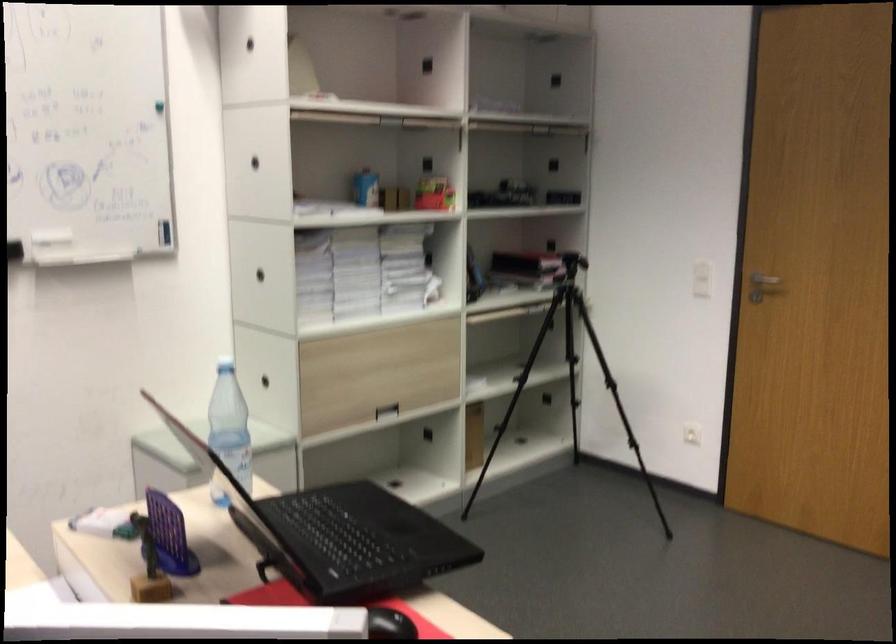
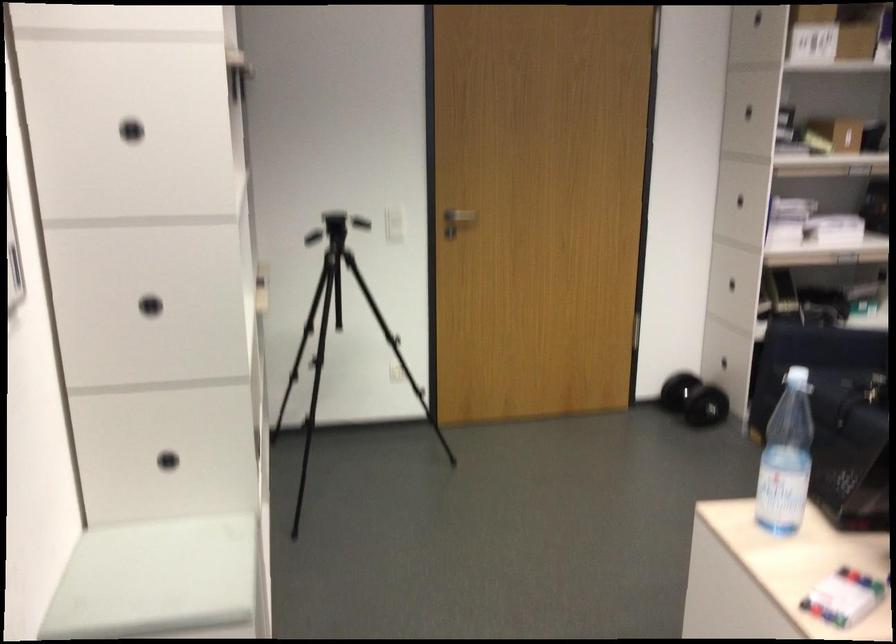
Find the pixel in the second image that matches (x=670, y=384) in the first image.

(339, 334)